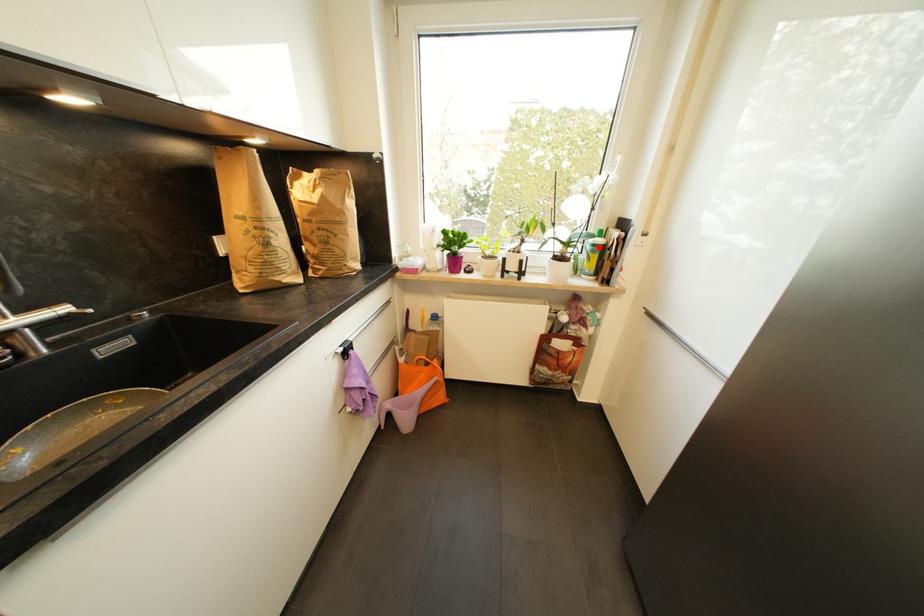
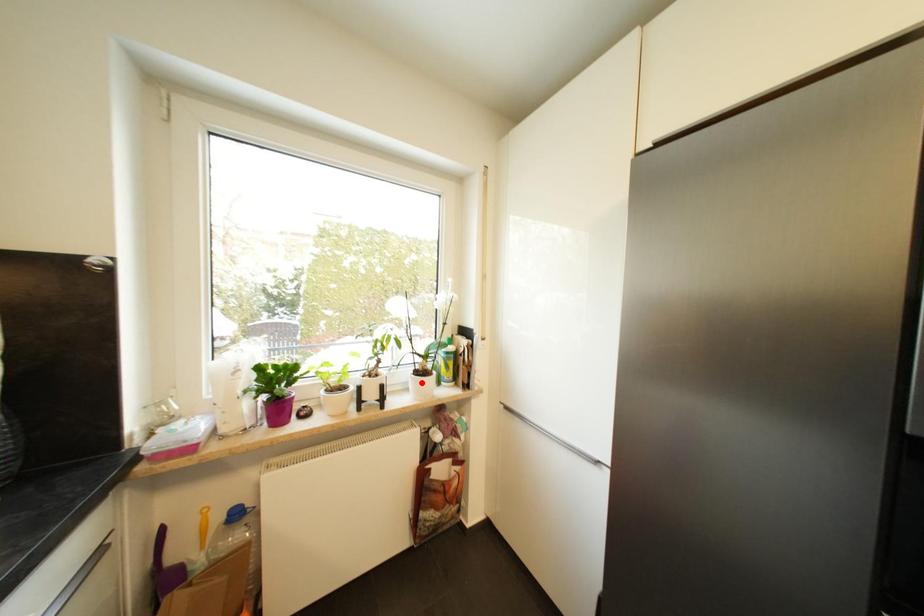
I am providing you with two images of the same scene from different viewpoints. A red point is marked on the first image and another point is marked on the second image. Do the highlighted points in image1 and image2 indicate the same real-world spot?

No